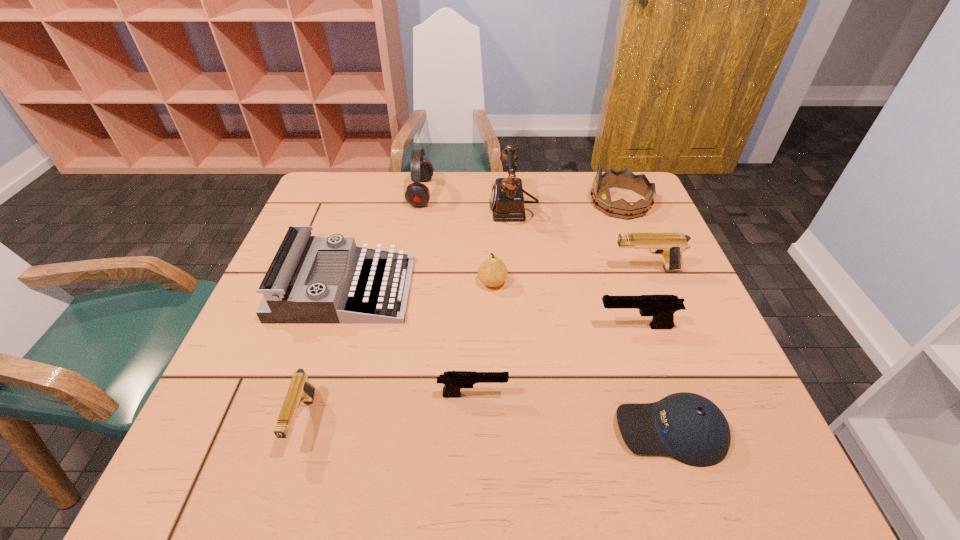
Image resolution: width=960 pixels, height=540 pixels. I want to click on vacant area situated on the front-facing side of the baseball cap, so click(463, 430).

The image size is (960, 540). What are the coordinates of `free space located 0.270m on the front-facing side of the baseball cap` in the screenshot? It's located at (468, 430).

Locate an element on the screen. The image size is (960, 540). vacant space located on the front-facing side of the baseball cap is located at coordinates (528, 430).

Identify the location of telephone at the far edge. (507, 200).

This screenshot has width=960, height=540. In order to click on earphone that is at the far edge in this screenshot , I will do `click(417, 194)`.

The width and height of the screenshot is (960, 540). Find the location of `tiara that is at the far edge`. tiara that is at the far edge is located at coordinates (625, 179).

Where is `pistol that is at the near edge`? The width and height of the screenshot is (960, 540). pistol that is at the near edge is located at coordinates (300, 390).

The height and width of the screenshot is (540, 960). Identify the location of baseball cap at the near edge. (689, 427).

Where is `object located in the left edge section of the desktop`? object located in the left edge section of the desktop is located at coordinates (291, 295).

The height and width of the screenshot is (540, 960). In order to click on tiara situated at the right edge in this screenshot , I will do `click(625, 179)`.